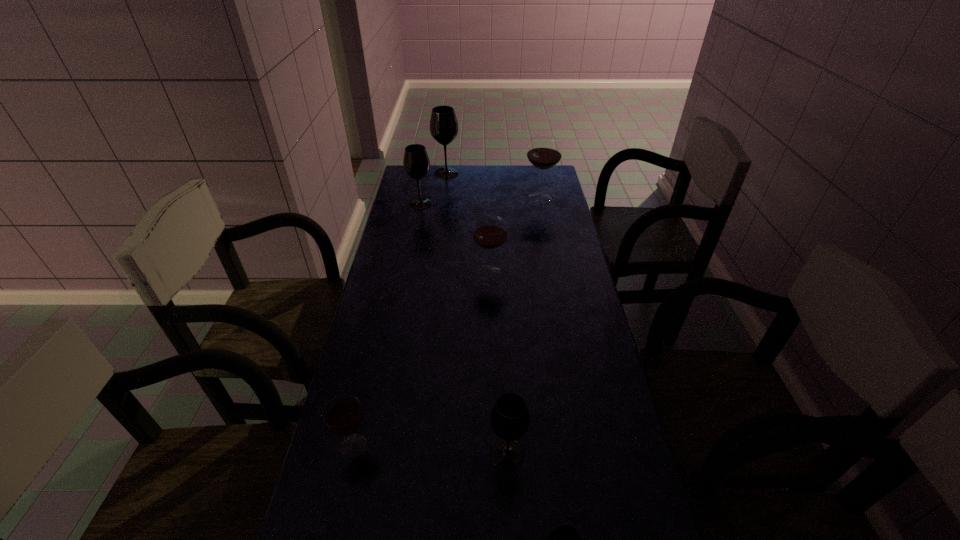
You are a GUI agent. You are given a task and a screenshot of the screen. Output one action in this format:
    pyautogui.click(x=<x>, y=<y>)
    Task: Click on the vacant space at the left edge of the desktop
    
    Given the screenshot: What is the action you would take?
    pyautogui.click(x=324, y=494)

The height and width of the screenshot is (540, 960). What are the coordinates of `vacant space at the right edge` in the screenshot? It's located at (607, 394).

The width and height of the screenshot is (960, 540). I want to click on free space at the far right corner of the desktop, so click(x=531, y=180).

I want to click on blank region between the third nearest gray wineglass and the farthest object, so click(434, 188).

Locate an element on the screen. The image size is (960, 540). free spot between the second nearest red wineglass and the farthest red wineglass is located at coordinates (515, 235).

The height and width of the screenshot is (540, 960). I want to click on free point between the second farthest red wineglass and the tallest object, so click(x=468, y=223).

You are a GUI agent. You are given a task and a screenshot of the screen. Output one action in this format:
    pyautogui.click(x=<x>, y=<y>)
    Task: Click on the free area in between the second biggest red wineglass and the farthest object
    
    Given the screenshot: What is the action you would take?
    pyautogui.click(x=468, y=223)

At what (x,y) coordinates should I click in order to perform the action: click on free space between the second red wineglass from right to left and the nearest red wineglass. Please return your answer as a coordinate pair (x, y). Looking at the image, I should click on (421, 359).

Locate an element on the screen. Image resolution: width=960 pixels, height=540 pixels. free point between the smallest red wineglass and the second nearest gray wineglass is located at coordinates (431, 450).

This screenshot has width=960, height=540. In order to click on vacant area that lies between the third biggest gray wineglass and the leftmost red wineglass in this screenshot , I will do `click(431, 450)`.